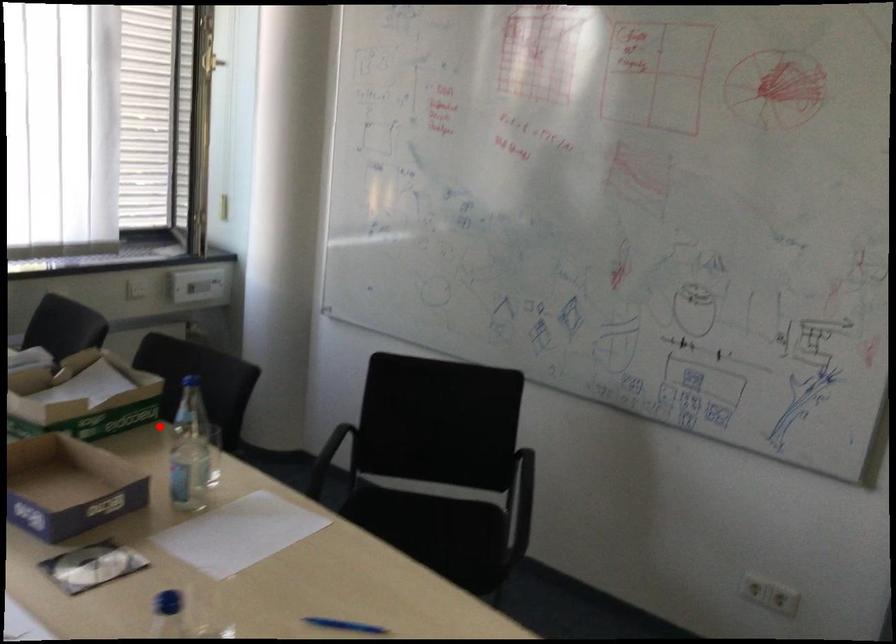
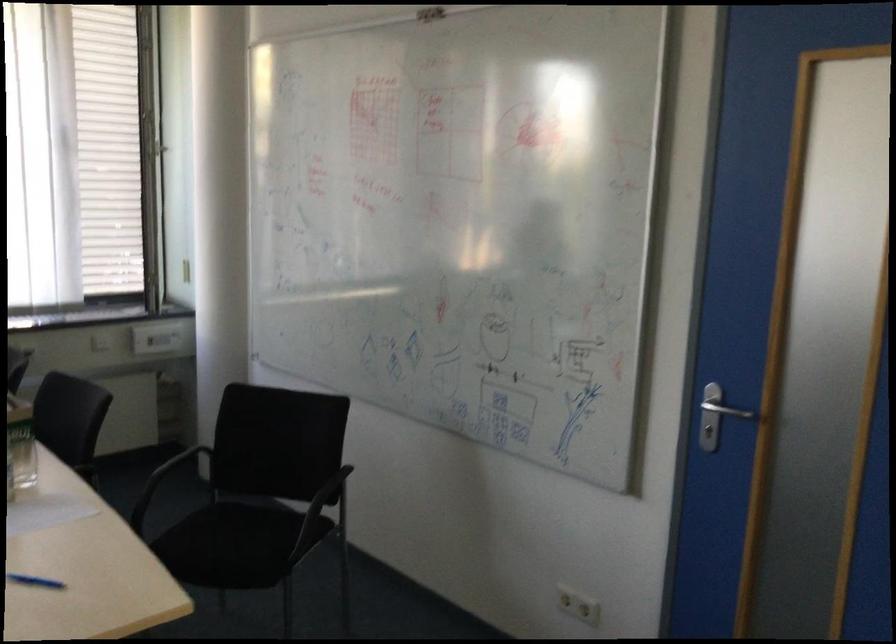
Where in the second image is the point corresponding to the highlighted location from the first image?

(21, 444)